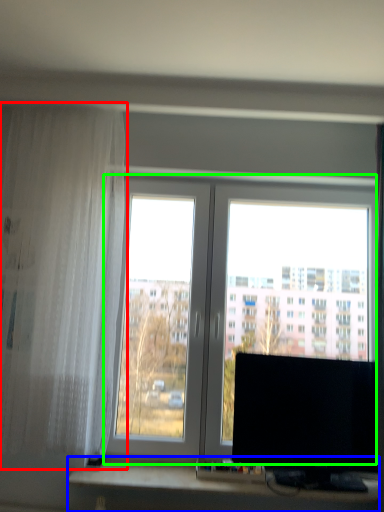
Question: Which object is positioned closest to curtain (highlighted by a red box)? Select from computer desk (highlighted by a blue box) and window (highlighted by a green box).

Choices:
 (A) computer desk
 (B) window

Answer: (B)